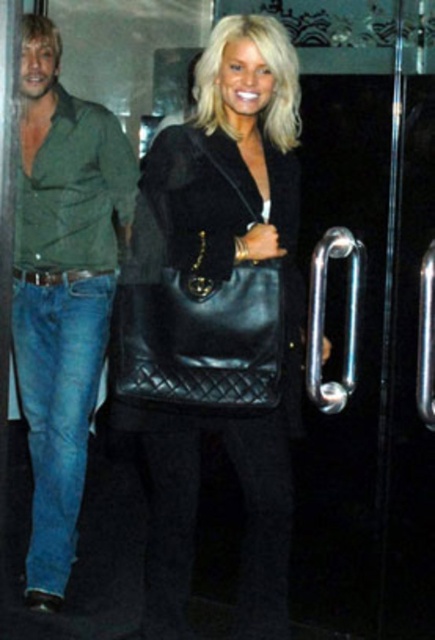
Measure the distance between green denim jeans at left and black leather handbag at center.

The distance of green denim jeans at left from black leather handbag at center is 16.24 inches.

Describe the element at coordinates (62, 291) in the screenshot. I see `green denim jeans at left` at that location.

The height and width of the screenshot is (640, 435). What do you see at coordinates (62, 291) in the screenshot? I see `green denim jeans at left` at bounding box center [62, 291].

I want to click on green denim jeans at left, so 62,291.

Who is shorter, black leather bag at center or green denim jeans at left?

Standing shorter between the two is black leather bag at center.

Is point (154, 314) positioned after point (106, 138)?

No, (154, 314) is closer to viewer.

You are a GUI agent. You are given a task and a screenshot of the screen. Output one action in this format:
    pyautogui.click(x=<x>, y=<y>)
    Task: Click on the black leather bag at center
    This screenshot has height=640, width=435.
    Given the screenshot: What is the action you would take?
    pyautogui.click(x=217, y=317)

Who is positioned more to the left, black leather bag at center or blue denim jeans at left?

From the viewer's perspective, blue denim jeans at left appears more on the left side.

In the scene shown: Which of these two, black leather bag at center or blue denim jeans at left, stands shorter?

blue denim jeans at left is shorter.

This screenshot has width=435, height=640. In order to click on black leather bag at center in this screenshot , I will do `click(217, 317)`.

Locate an element on the screen. black leather bag at center is located at coordinates (217, 317).